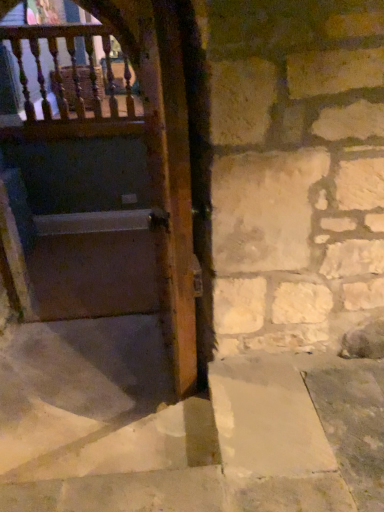
Question: Is smooth concrete stairs at center positioned behind wooden balusters at upper left?

Choices:
 (A) no
 (B) yes

Answer: (A)

Question: Is smooth concrete stairs at center turned away from wooden balusters at upper left?

Choices:
 (A) yes
 (B) no

Answer: (B)

Question: Would you say smooth concrete stairs at center is outside wooden balusters at upper left?

Choices:
 (A) no
 (B) yes

Answer: (B)

Question: Considering the relative positions of smooth concrete stairs at center and wooden balusters at upper left in the image provided, is smooth concrete stairs at center to the left of wooden balusters at upper left from the viewer's perspective?

Choices:
 (A) no
 (B) yes

Answer: (A)

Question: Is smooth concrete stairs at center touching wooden balusters at upper left?

Choices:
 (A) no
 (B) yes

Answer: (A)

Question: Is wooden balusters at upper left wider or thinner than smooth concrete stairs at center?

Choices:
 (A) thin
 (B) wide

Answer: (A)

Question: Considering the positions of wooden balusters at upper left and smooth concrete stairs at center in the image, is wooden balusters at upper left bigger or smaller than smooth concrete stairs at center?

Choices:
 (A) big
 (B) small

Answer: (B)

Question: Which is correct: wooden balusters at upper left is inside smooth concrete stairs at center, or outside of it?

Choices:
 (A) inside
 (B) outside

Answer: (B)

Question: Is point (54, 37) closer or farther from the camera than point (127, 496)?

Choices:
 (A) farther
 (B) closer

Answer: (A)

Question: Is point (254, 414) positioned closer to the camera than point (178, 206)?

Choices:
 (A) farther
 (B) closer

Answer: (A)

Question: From a real-world perspective, is smooth concrete stairs at center above or below matte wooden door at left?

Choices:
 (A) above
 (B) below

Answer: (B)

Question: Considering the relative positions of smooth concrete stairs at center and matte wooden door at left in the image provided, is smooth concrete stairs at center to the left or to the right of matte wooden door at left?

Choices:
 (A) left
 (B) right

Answer: (B)

Question: In terms of width, does smooth concrete stairs at center look wider or thinner when compared to matte wooden door at left?

Choices:
 (A) wide
 (B) thin

Answer: (A)

Question: Looking at the image, does smooth concrete stairs at center seem bigger or smaller compared to wooden balusters at upper left?

Choices:
 (A) big
 (B) small

Answer: (A)

Question: Is smooth concrete stairs at center wider or thinner than wooden balusters at upper left?

Choices:
 (A) thin
 (B) wide

Answer: (B)